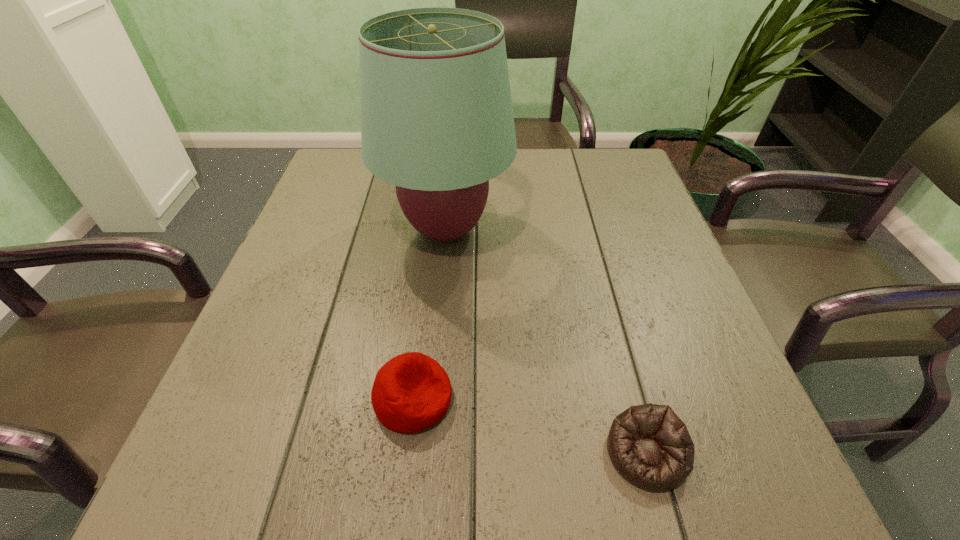
The height and width of the screenshot is (540, 960). Identify the location of the tallest object. (437, 122).

Locate an element on the screen. The image size is (960, 540). the farthest object is located at coordinates (437, 122).

This screenshot has width=960, height=540. Find the location of `the left beanbag`. the left beanbag is located at coordinates (412, 392).

The width and height of the screenshot is (960, 540). I want to click on the second tallest object, so click(412, 392).

The width and height of the screenshot is (960, 540). Find the location of `the shorter beanbag`. the shorter beanbag is located at coordinates (649, 445).

Where is `the shortest object`? the shortest object is located at coordinates (649, 445).

Where is `vacant space situated 0.290m on the right of the farthest object`? The image size is (960, 540). vacant space situated 0.290m on the right of the farthest object is located at coordinates (640, 230).

Find the location of `blank space located 0.280m on the seat area of the left beanbag`. blank space located 0.280m on the seat area of the left beanbag is located at coordinates (629, 399).

You are a GUI agent. You are given a task and a screenshot of the screen. Output one action in this format:
    pyautogui.click(x=<x>, y=<y>)
    Task: Click on the vacant space located on the left of the right beanbag
    This screenshot has width=960, height=540.
    Given the screenshot: What is the action you would take?
    pyautogui.click(x=420, y=453)

This screenshot has height=540, width=960. What are the coordinates of `object that is at the far edge` in the screenshot? It's located at (437, 122).